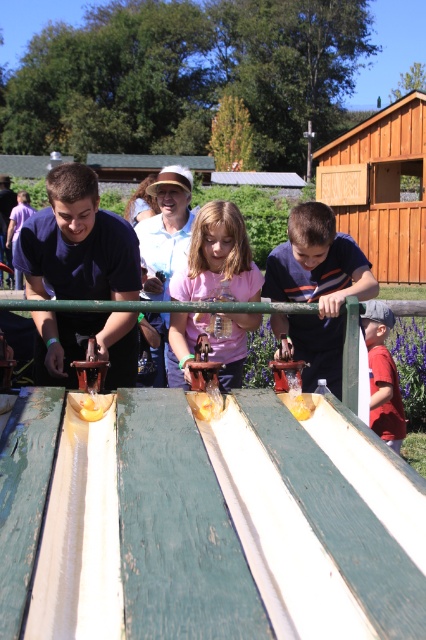
Does green weathered wood ramp at center have a larger size compared to pink matte shirt at center?

No, green weathered wood ramp at center is not bigger than pink matte shirt at center.

You are a GUI agent. You are given a task and a screenshot of the screen. Output one action in this format:
    pyautogui.click(x=<x>, y=<y>)
    Task: Click on the green weathered wood ramp at center
    This screenshot has height=640, width=426.
    Given the screenshot: What is the action you would take?
    pyautogui.click(x=206, y=522)

Who is more distant from viewer, [235,484] or [241,225]?

The point [241,225] is behind.

This screenshot has width=426, height=640. What are the coordinates of `green weathered wood ramp at center` in the screenshot? It's located at (206, 522).

Which is more to the right, green weathered wood ramp at center or yellow matte bread at center?

green weathered wood ramp at center

Does point (278, 460) come farther from viewer compared to point (207, 417)?

No, it is not.

You are a GUI agent. You are given a task and a screenshot of the screen. Output one action in this format:
    pyautogui.click(x=<x>, y=<y>)
    Task: Click on the green weathered wood ramp at center
    
    Given the screenshot: What is the action you would take?
    pyautogui.click(x=206, y=522)

Does green wood rail at center have a lesser width compared to yellow rubber boat at center?

In fact, green wood rail at center might be wider than yellow rubber boat at center.

Between point (34, 300) and point (305, 408), which one is positioned in front?

Point (305, 408) is more forward.

At what (x,y) coordinates should I click in order to perform the action: click on green wood rail at center. Please return your answer as a coordinate pair (x, y). This screenshot has width=426, height=640. Looking at the image, I should click on (155, 305).